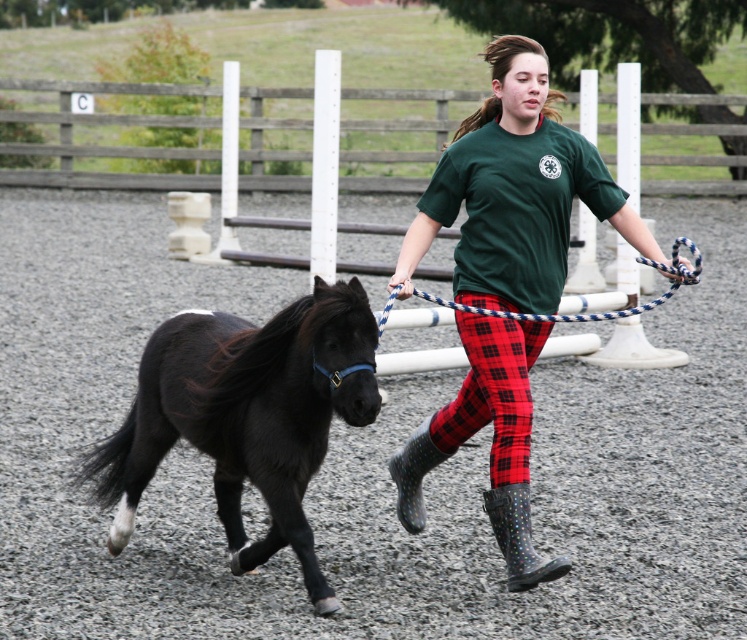
Is gray gravel dirt track at center taller than rubber dotted boot at lower center?

Correct, gray gravel dirt track at center is much taller as rubber dotted boot at lower center.

Between point (176, 618) and point (536, 566), which one is positioned behind?

Positioned behind is point (536, 566).

Does point (580, 609) come farther from viewer compared to point (539, 579)?

Yes, it is behind point (539, 579).

I want to click on gray gravel dirt track at center, so click(x=365, y=460).

Is green matte shirt at center above blue and white rope at center?

No, green matte shirt at center is not above blue and white rope at center.

Is green matte shirt at center smaller than blue and white rope at center?

Actually, green matte shirt at center might be larger than blue and white rope at center.

The image size is (747, 640). What are the coordinates of `green matte shirt at center` in the screenshot? It's located at (515, 193).

Does blue and white rope at center appear under rubber/matte boot at lower center?

No.

Which is behind, point (692, 273) or point (415, 500)?

The point (415, 500) is behind.

The width and height of the screenshot is (747, 640). I want to click on blue and white rope at center, so click(x=583, y=308).